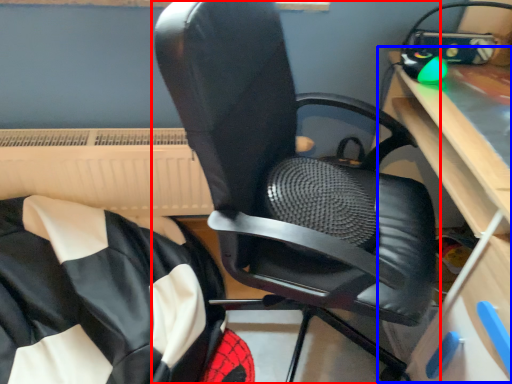
Question: Among these objects, which one is farthest to the camera, chair (highlighted by a red box) or computer desk (highlighted by a blue box)?

Choices:
 (A) chair
 (B) computer desk

Answer: (B)